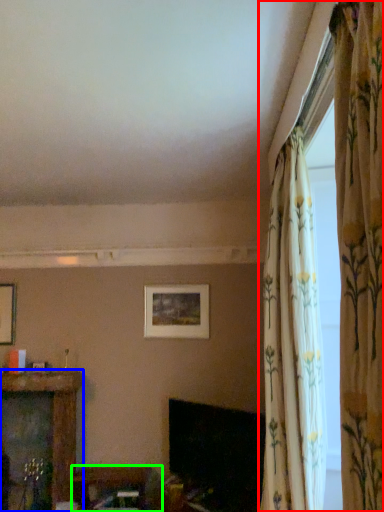
Question: Considering the real-world distances, which object is farthest from curtain (highlighted by a red box)? furniture (highlighted by a blue box) or furniture (highlighted by a green box)?

Choices:
 (A) furniture
 (B) furniture

Answer: (A)